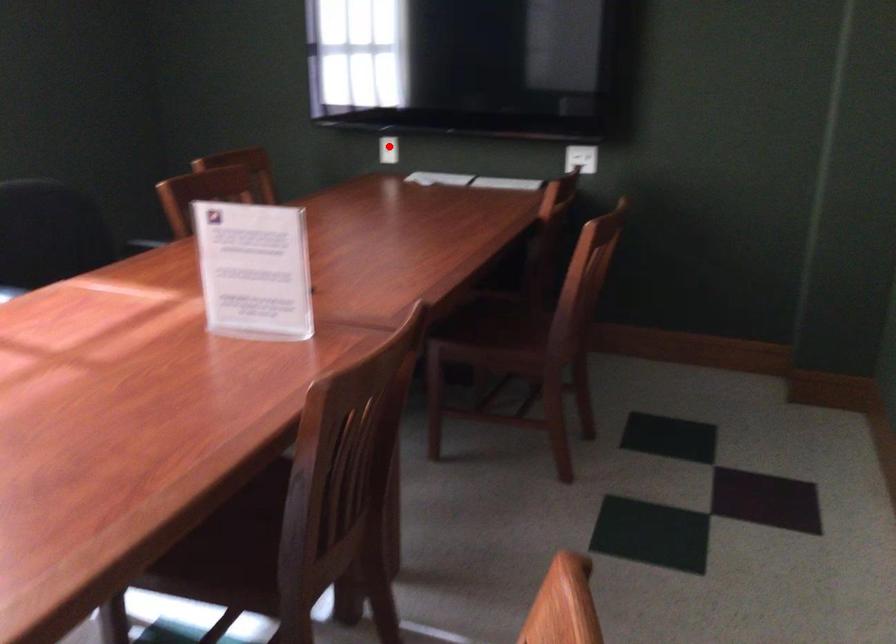
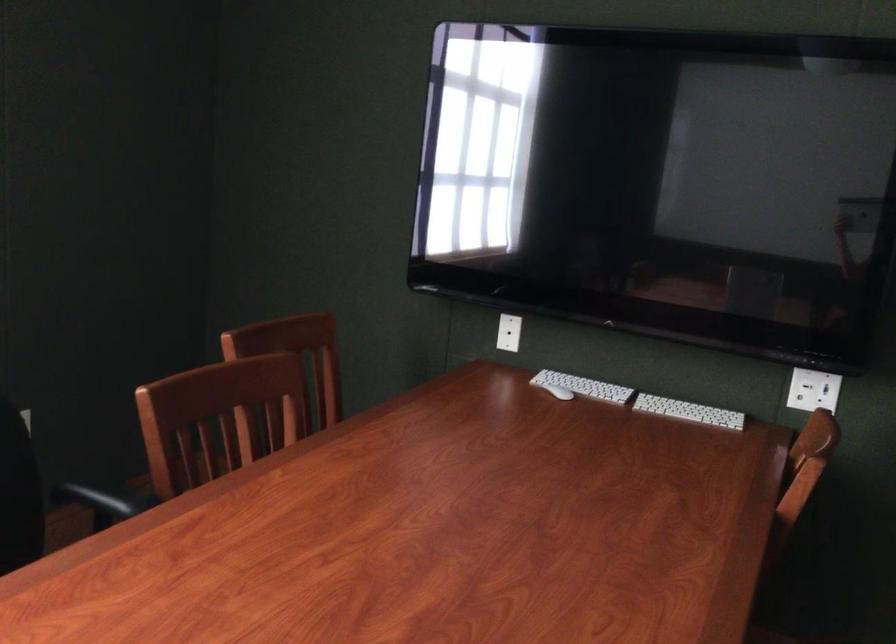
The point at the highlighted location is marked in the first image. Where is the corresponding point in the second image?

(509, 333)